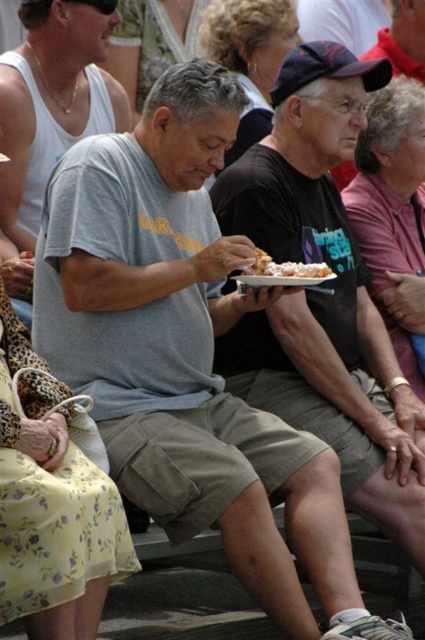
Does blonde hair at upper center have a larger size compared to frosted pastry at center?

No, blonde hair at upper center is not bigger than frosted pastry at center.

Is point (152, 10) positioned behind point (306, 269)?

Yes, point (152, 10) is behind point (306, 269).

Image resolution: width=425 pixels, height=640 pixels. Find the location of `blonde hair at upper center`. blonde hair at upper center is located at coordinates (150, 42).

Is gray cotton shirt at center positioned before curly blonde hair at upper center?

Yes, gray cotton shirt at center is in front of curly blonde hair at upper center.

Who is shorter, gray cotton shirt at center or curly blonde hair at upper center?

Standing shorter between the two is gray cotton shirt at center.

Does point (45, 13) come in front of point (244, 36)?

Yes, point (45, 13) is closer to viewer.

Identify the location of gray cotton shirt at center. The width and height of the screenshot is (425, 640). (53, 100).

Does point (105, 106) come farther from viewer compared to point (161, 32)?

No, (105, 106) is closer to viewer.

Between gray cotton shirt at center and blonde hair at upper center, which one appears on the left side from the viewer's perspective?

Positioned to the left is gray cotton shirt at center.

Measure the distance between gray cotton shirt at center and camera.

25.90 meters

The width and height of the screenshot is (425, 640). What are the coordinates of `gray cotton shirt at center` in the screenshot? It's located at (53, 100).